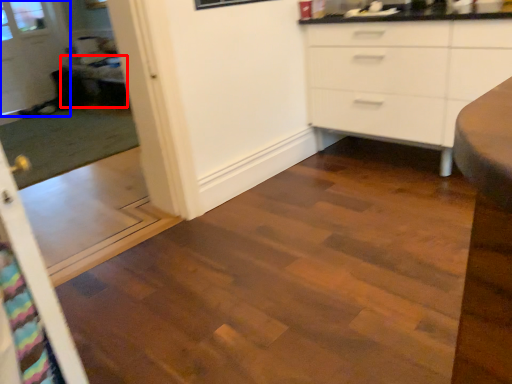
Question: Among these objects, which one is farthest to the camera, table (highlighted by a red box) or glass door (highlighted by a blue box)?

Choices:
 (A) table
 (B) glass door

Answer: (B)